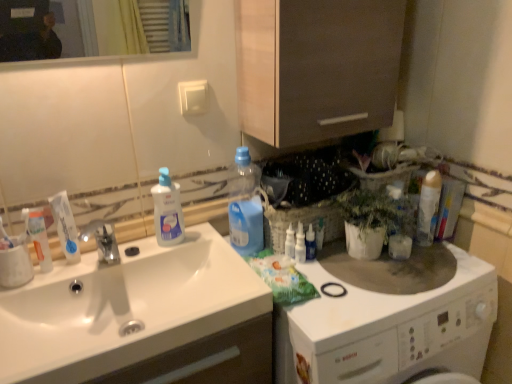
The width and height of the screenshot is (512, 384). In order to click on unoccupied region to the right of white matte toothpaste tube at left, the fourth toiletry in the right-to-left sequence in this screenshot , I will do `click(103, 263)`.